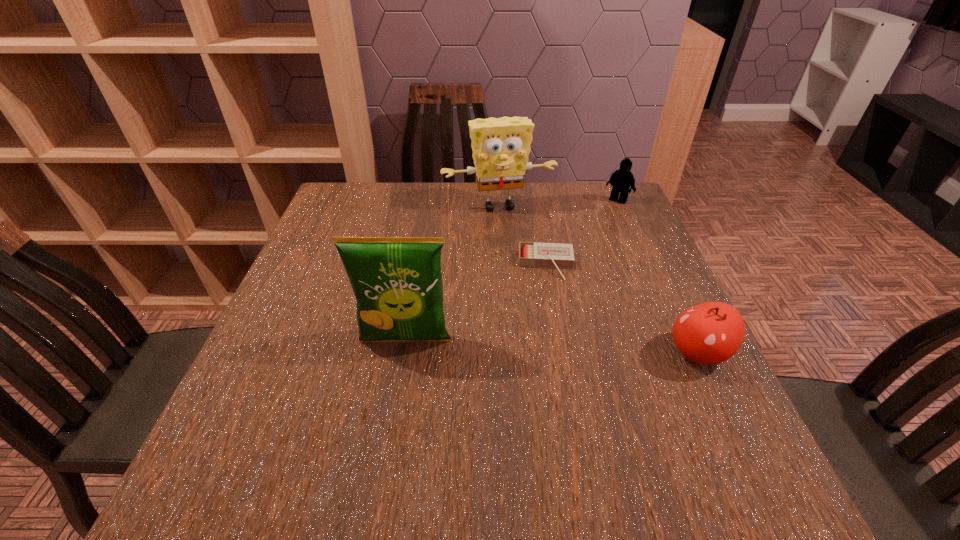
Locate an element on the screen. This screenshot has width=960, height=540. vacant region that satisfies the following two spatial constraints: 1. on the front-facing side of the apple; 2. on the right side of the crisp (potato chip) is located at coordinates (403, 353).

The height and width of the screenshot is (540, 960). In order to click on blank area in the image that satisfies the following two spatial constraints: 1. on the back side of the third nearest object; 2. on the left side of the Lego in this screenshot , I will do `click(535, 200)`.